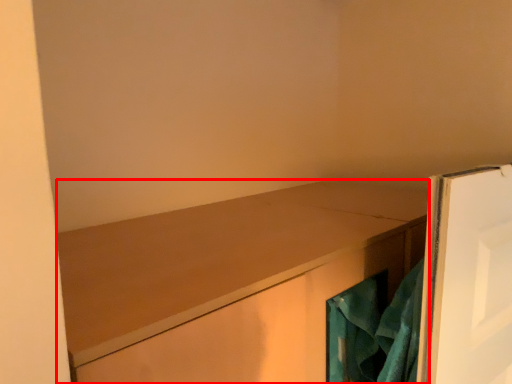
Question: Observing the image, what is the correct spatial positioning of cabinetry (annotated by the red box) in reference to laundry?

Choices:
 (A) left
 (B) right

Answer: (A)